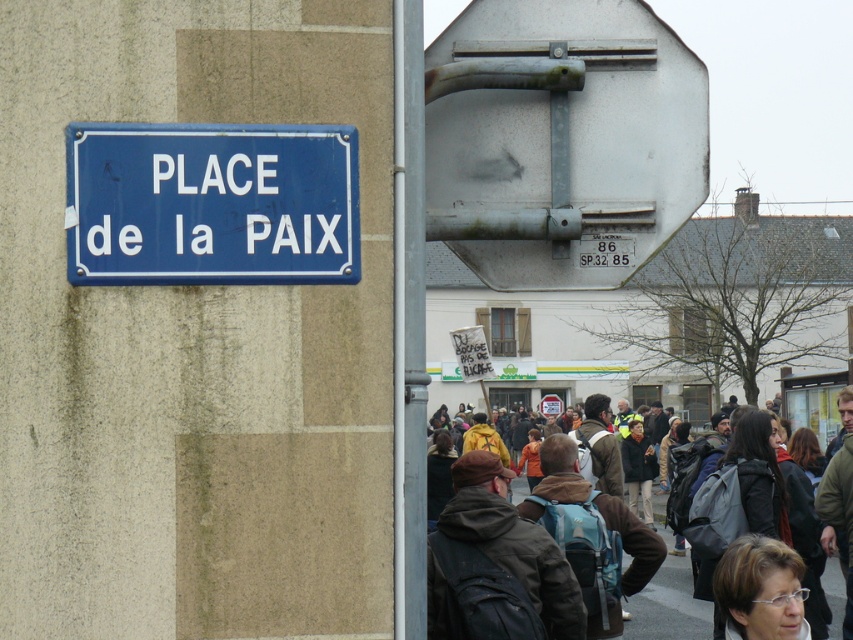
Question: Where is blue painted metal sign at upper left located in relation to dark brown leather jacket at center in the image?

Choices:
 (A) left
 (B) right

Answer: (A)

Question: Which of the following is the closest to the observer?

Choices:
 (A) (618, 180)
 (B) (764, 637)
 (C) (339, 280)

Answer: (C)

Question: Does rusty metal basketball hoop at upper center appear over matte black glasses at lower right?

Choices:
 (A) yes
 (B) no

Answer: (A)

Question: Does rusty metal basketball hoop at upper center have a larger size compared to matte black glasses at lower right?

Choices:
 (A) yes
 (B) no

Answer: (A)

Question: Estimate the real-world distances between objects in this image. Which object is farther from the blue painted metal sign at upper left?

Choices:
 (A) rusty metal basketball hoop at upper center
 (B) matte black glasses at lower right

Answer: (B)

Question: Which point is closer to the camera?

Choices:
 (A) rusty metal basketball hoop at upper center
 (B) matte black glasses at lower right

Answer: (A)